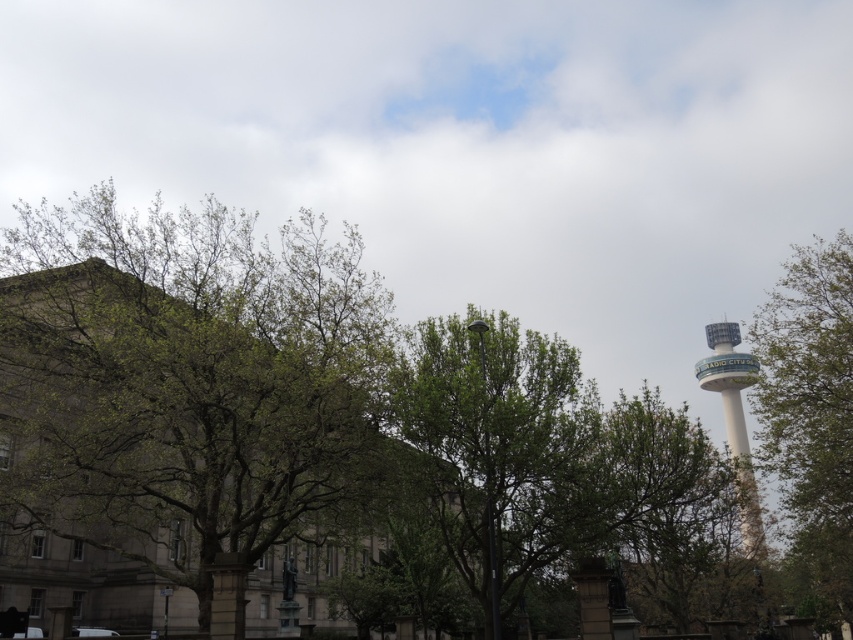
Question: Which point is farther from the camera taking this photo?

Choices:
 (A) (624, 420)
 (B) (805, 321)

Answer: (B)

Question: Which object is positioned farthest from the white concrete tower at right?

Choices:
 (A) green leafy tree at center
 (B) green leafy tree at right

Answer: (A)

Question: Considering the relative positions of green leafy tree at center and white concrete tower at right in the image provided, where is green leafy tree at center located with respect to white concrete tower at right?

Choices:
 (A) left
 (B) right

Answer: (A)

Question: Which object appears farthest from the camera in this image?

Choices:
 (A) white concrete tower at right
 (B) green leafy tree at right
 (C) green leafy tree at center

Answer: (B)

Question: From the image, what is the correct spatial relationship of green leafy tree at right in relation to white concrete tower at right?

Choices:
 (A) right
 (B) left

Answer: (A)

Question: Does green leafy tree at center appear on the left side of white concrete tower at right?

Choices:
 (A) no
 (B) yes

Answer: (B)